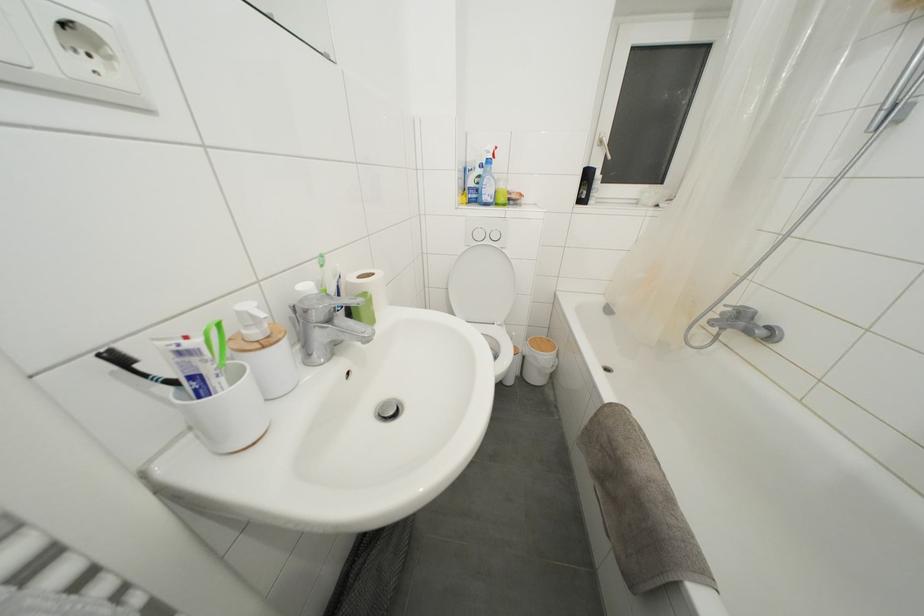
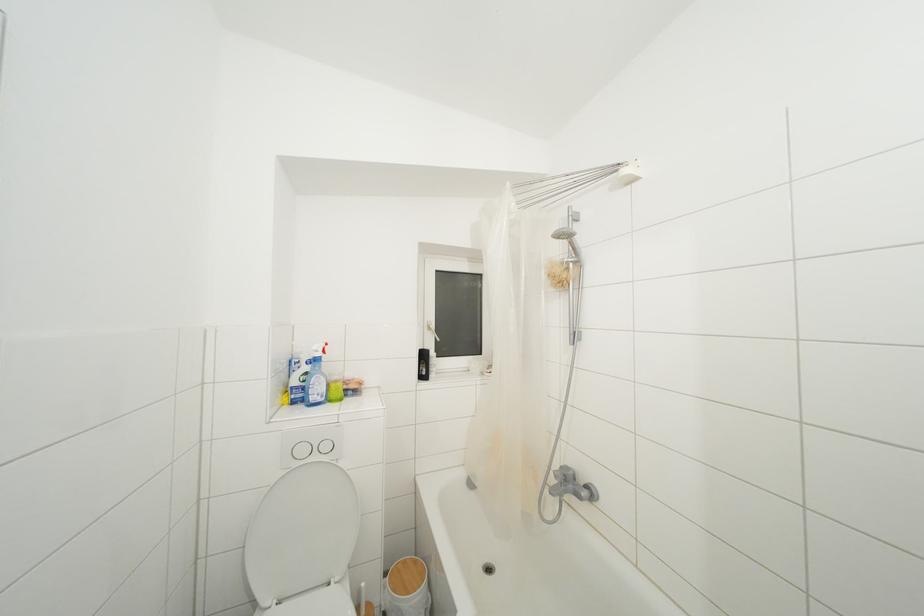
Where in the second image is the point corresponding to (544,342) from the first image?

(408, 567)